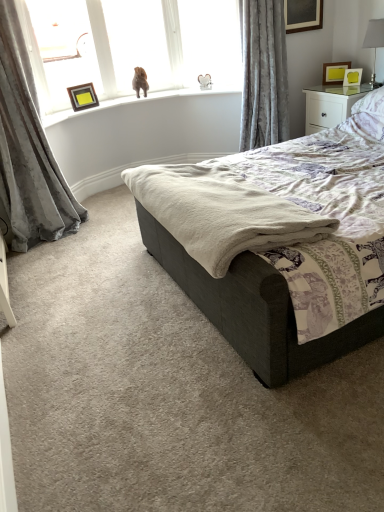
Question: Considering the relative positions of velvet gray curtain at left, the first curtain viewed from the left, and white soft pillow at upper right in the image provided, is velvet gray curtain at left, the first curtain viewed from the left, to the left of white soft pillow at upper right from the viewer's perspective?

Choices:
 (A) no
 (B) yes

Answer: (B)

Question: Does velvet gray curtain at left, which is the 2th curtain from right to left, come behind white soft pillow at upper right?

Choices:
 (A) yes
 (B) no

Answer: (B)

Question: Does velvet gray curtain at left, which is the 2th curtain from right to left, have a smaller size compared to white soft pillow at upper right?

Choices:
 (A) no
 (B) yes

Answer: (A)

Question: Can you confirm if velvet gray curtain at left, the first curtain viewed from the left, is thinner than white soft pillow at upper right?

Choices:
 (A) yes
 (B) no

Answer: (A)

Question: Is the position of velvet gray curtain at left, the first curtain viewed from the left, less distant than that of white soft pillow at upper right?

Choices:
 (A) no
 (B) yes

Answer: (B)

Question: Do you think velvet gray curtain at upper right, which is the 2th curtain in left-to-right order, is within beige fleece blanket at center, or outside of it?

Choices:
 (A) outside
 (B) inside

Answer: (A)

Question: Is velvet gray curtain at upper right, which is the 2th curtain in left-to-right order, wider or thinner than beige fleece blanket at center?

Choices:
 (A) thin
 (B) wide

Answer: (A)

Question: From a real-world perspective, relative to beige fleece blanket at center, is velvet gray curtain at upper right, which is the 2th curtain in left-to-right order, vertically above or below?

Choices:
 (A) below
 (B) above

Answer: (B)

Question: Is velvet gray curtain at upper right, which is the 2th curtain in left-to-right order, in front of or behind beige fleece blanket at center in the image?

Choices:
 (A) front
 (B) behind

Answer: (B)

Question: Is white glossy nightstand at upper right wider or thinner than matte yellow picture frame at upper right, which ranks as the 2th picture frame in right-to-left order?

Choices:
 (A) wide
 (B) thin

Answer: (A)

Question: From their relative heights in the image, would you say white glossy nightstand at upper right is taller or shorter than matte yellow picture frame at upper right, which is the second picture frame from left to right?

Choices:
 (A) short
 (B) tall

Answer: (B)

Question: Is white glossy nightstand at upper right to the left or to the right of matte yellow picture frame at upper right, which is the second picture frame from left to right, in the image?

Choices:
 (A) right
 (B) left

Answer: (A)

Question: Is white glossy nightstand at upper right inside the boundaries of matte yellow picture frame at upper right, which is the second picture frame from left to right, or outside?

Choices:
 (A) inside
 (B) outside

Answer: (B)

Question: From the image's perspective, is velvet gray curtain at left, which is the 2th curtain from right to left, located above or below dark gray fabric bed at center?

Choices:
 (A) below
 (B) above

Answer: (B)

Question: In terms of width, does velvet gray curtain at left, the first curtain viewed from the left, look wider or thinner when compared to dark gray fabric bed at center?

Choices:
 (A) thin
 (B) wide

Answer: (A)